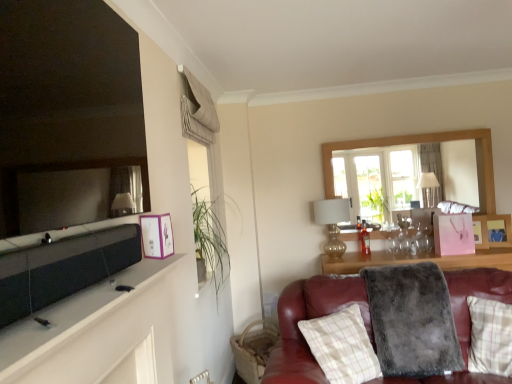
Question: From a real-world perspective, relative to brown woven basket at lower right, is gold metallic lamp at upper right vertically above or below?

Choices:
 (A) above
 (B) below

Answer: (A)

Question: Considering the positions of gold metallic lamp at upper right and brown woven basket at lower right in the image, is gold metallic lamp at upper right wider or thinner than brown woven basket at lower right?

Choices:
 (A) thin
 (B) wide

Answer: (A)

Question: Estimate the real-world distances between objects in this image. Which object is farther from the matte black mirror at upper left?

Choices:
 (A) brown woven basket at lower right
 (B) plaid fabric pillow at lower right, which is the first pillow in left-to-right order
 (C) plaid fabric pillow at lower right, the second pillow positioned from the left
 (D) gold metallic lamp at upper right
 (E) matte black tv at upper left

Answer: (D)

Question: Estimate the real-world distances between objects in this image. Which object is closer to the wooden photo frame at upper right, which is counted as the first picture frame, starting from the back?

Choices:
 (A) gray fluffy blanket at lower right
 (B) matte black mirror at upper left
 (C) brown woven basket at lower right
 (D) plaid fabric pillow at lower right, which is the first pillow in left-to-right order
 (E) purple paper picture frame at upper left, which appears as the first picture frame when viewed from the left

Answer: (A)